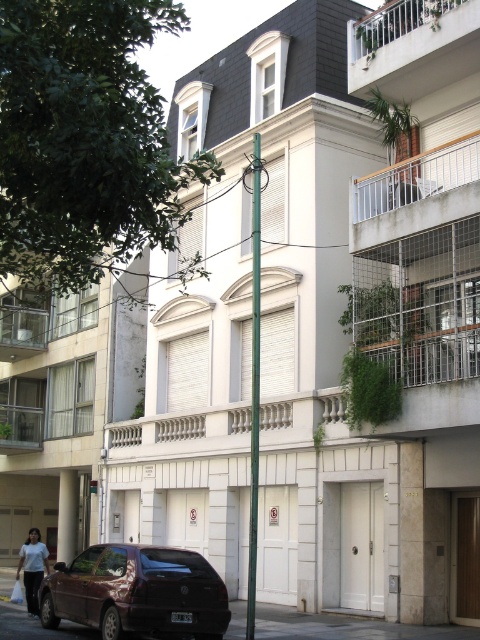
Question: Can you confirm if white metal railing at upper center is positioned below white cotton shirt at lower left?

Choices:
 (A) yes
 (B) no

Answer: (B)

Question: Which object is the farthest from the white metal railing at upper right?

Choices:
 (A) white metal railing at upper center
 (B) shiny maroon hatchback at lower left

Answer: (B)

Question: Which point is closer to the camera?

Choices:
 (A) shiny maroon hatchback at lower left
 (B) white metal railing at upper center

Answer: (A)

Question: Is white metal railing at upper right below white cotton shirt at lower left?

Choices:
 (A) no
 (B) yes

Answer: (A)

Question: Which point is farther from the camera taking this photo?

Choices:
 (A) (27, 611)
 (B) (124, 588)

Answer: (A)

Question: Can you confirm if white metal railing at upper right is positioned below white cotton shirt at lower left?

Choices:
 (A) no
 (B) yes

Answer: (A)